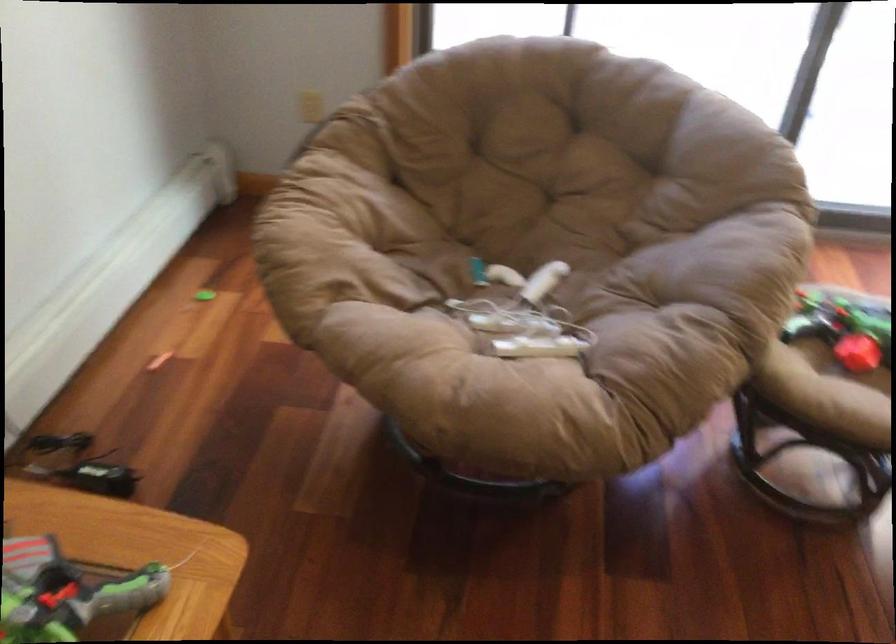
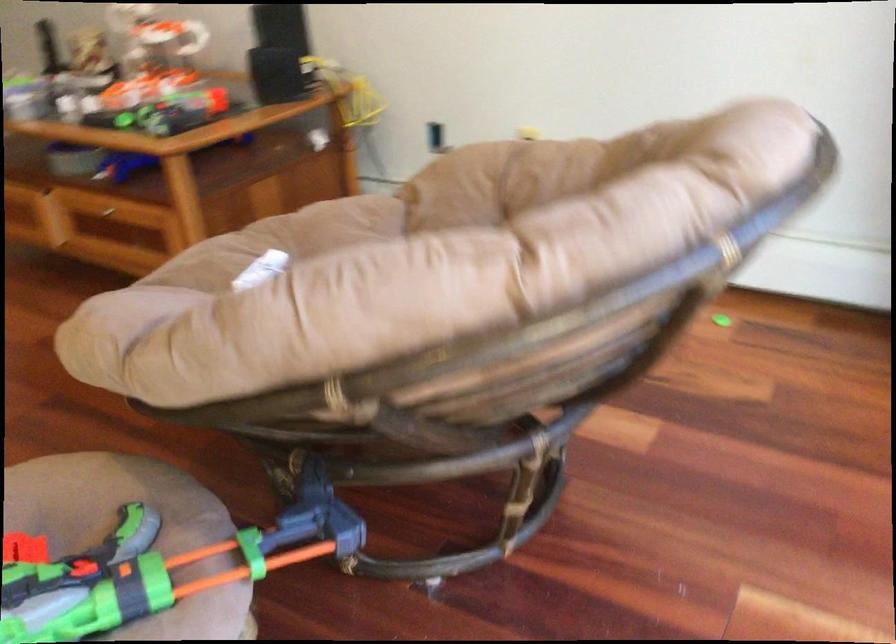
The point at (467, 348) is marked in the first image. Where is the corresponding point in the second image?

(281, 241)